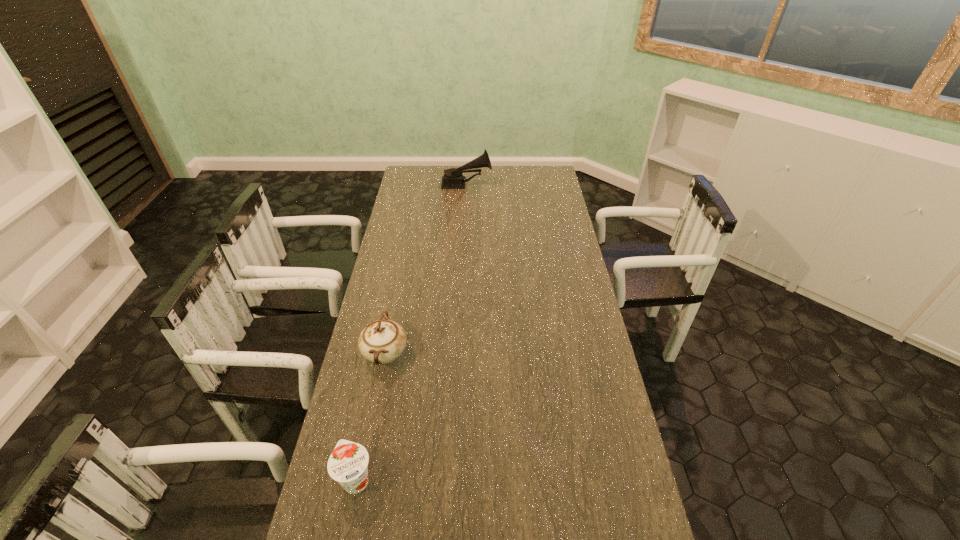
The image size is (960, 540). In order to click on chinaware that is at the left edge in this screenshot , I will do `click(382, 341)`.

The image size is (960, 540). I want to click on yogurt located at the left edge, so click(x=348, y=462).

In the image, there is a desktop. At what (x,y) coordinates should I click in order to perform the action: click on vacant space at the far edge. Please return your answer as a coordinate pair (x, y). The image size is (960, 540). Looking at the image, I should click on (513, 173).

In the image, there is a desktop. Identify the location of vacant area at the left edge. (365, 506).

I want to click on vacant space at the right edge of the desktop, so click(x=604, y=420).

Where is `unoccupied area between the tallest object and the chinaware`? unoccupied area between the tallest object and the chinaware is located at coordinates (426, 269).

Identify the location of vacant space in between the tallest object and the second tallest object. (426, 269).

Locate an element on the screen. vacant area that lies between the phonograph_record and the shortest object is located at coordinates (412, 332).

The width and height of the screenshot is (960, 540). Find the location of `empty space between the yogurt and the chinaware`. empty space between the yogurt and the chinaware is located at coordinates (371, 416).

Identify the location of empty space that is in between the chinaware and the tallest object. This screenshot has height=540, width=960. (426, 269).